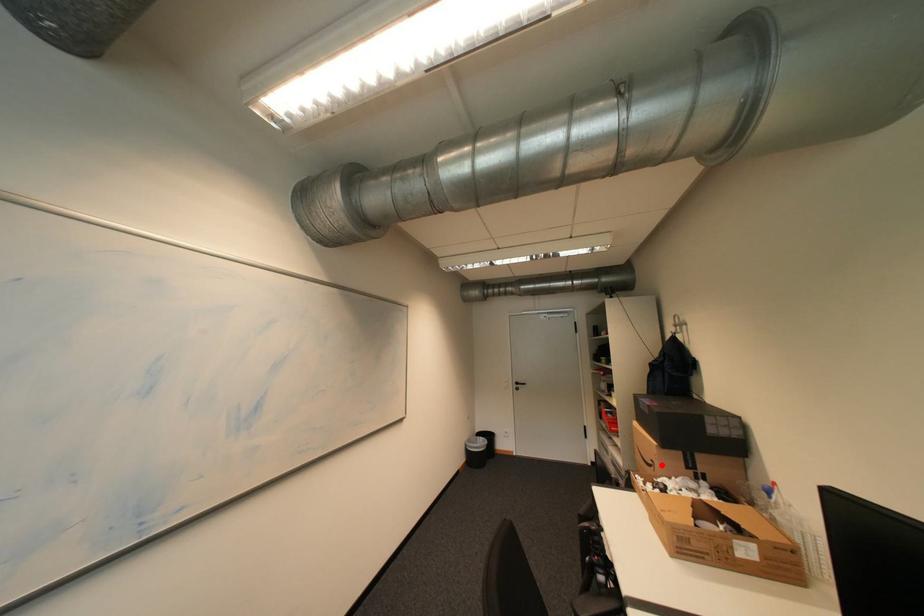
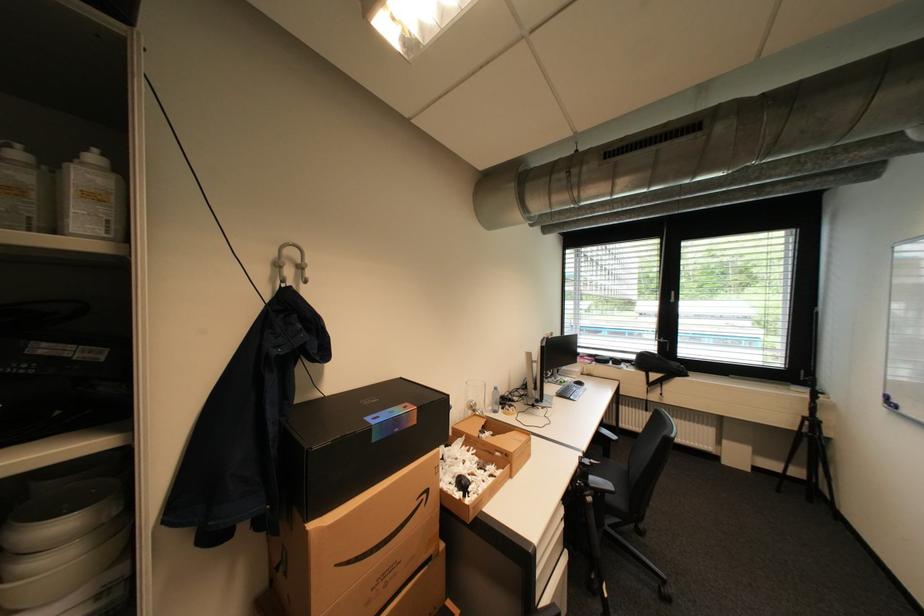
Where in the second image is the point corresponding to the highlighted location from the first image?

(433, 496)